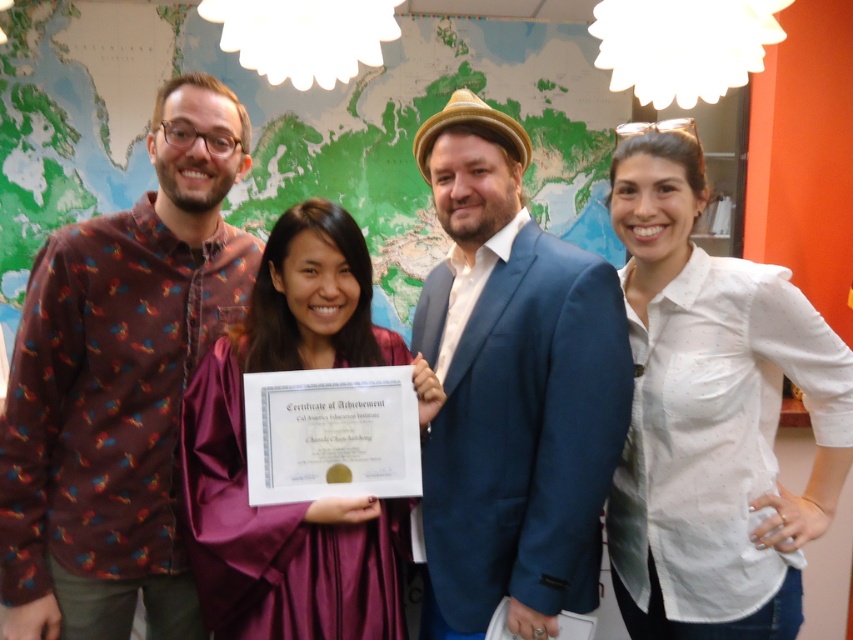
Question: Can you confirm if brown printed shirt at left is positioned above white dotted shirt at right?

Choices:
 (A) yes
 (B) no

Answer: (A)

Question: Estimate the real-world distances between objects in this image. Which object is closer to the brown printed shirt at left?

Choices:
 (A) white paper certificate at center
 (B) white dotted shirt at right
 (C) purple satin dress at center
 (D) blue fabric suit at center

Answer: (C)

Question: Which point is closer to the camera?

Choices:
 (A) (543, 467)
 (B) (344, 564)
 (C) (36, 484)

Answer: (A)

Question: Which of the following is the closest to the observer?

Choices:
 (A) (28, 548)
 (B) (328, 374)

Answer: (B)

Question: Can you confirm if blue fabric suit at center is positioned above purple satin dress at center?

Choices:
 (A) no
 (B) yes

Answer: (B)

Question: Can you confirm if brown printed shirt at left is bigger than blue fabric suit at center?

Choices:
 (A) yes
 (B) no

Answer: (A)